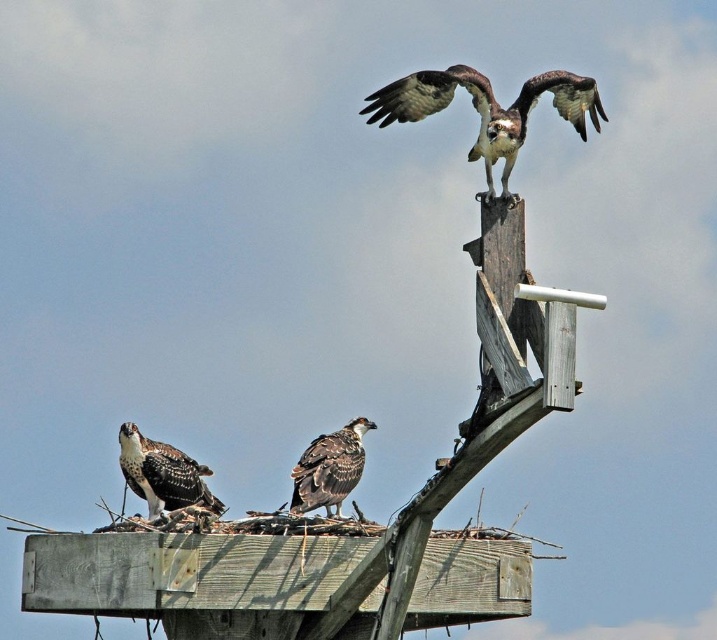
Question: Among these objects, which one is nearest to the camera?

Choices:
 (A) brown speckled feathers at lower left
 (B) dark brown feathers at center
 (C) brown speckled feathers at upper center

Answer: (C)

Question: Does brown speckled feathers at upper center have a greater width compared to dark brown feathers at center?

Choices:
 (A) yes
 (B) no

Answer: (A)

Question: Can you confirm if brown speckled feathers at upper center is smaller than dark brown feathers at center?

Choices:
 (A) no
 (B) yes

Answer: (A)

Question: Considering the real-world distances, which object is closest to the dark brown feathers at center?

Choices:
 (A) brown speckled feathers at lower left
 (B) brown speckled feathers at upper center

Answer: (A)

Question: Does brown speckled feathers at upper center appear on the right side of dark brown feathers at center?

Choices:
 (A) yes
 (B) no

Answer: (A)

Question: Which point is farther to the camera?

Choices:
 (A) brown speckled feathers at lower left
 (B) brown speckled feathers at upper center
 (C) dark brown feathers at center

Answer: (A)